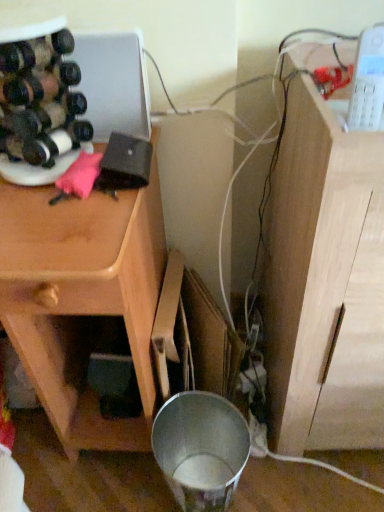
Question: Is matte black wine bottle at left, arranged as the first wine bottle when viewed from the top, thinner than light wood cabinet at right?

Choices:
 (A) yes
 (B) no

Answer: (A)

Question: Is matte black wine bottle at left, arranged as the first wine bottle when viewed from the top, next to light wood cabinet at right and touching it?

Choices:
 (A) yes
 (B) no

Answer: (B)

Question: From a real-world perspective, is matte black wine bottle at left, the 2th wine bottle in the bottom-to-top sequence, located higher than light wood cabinet at right?

Choices:
 (A) yes
 (B) no

Answer: (A)

Question: Considering the relative sizes of matte black wine bottle at left, the 2th wine bottle in the bottom-to-top sequence, and light wood cabinet at right in the image provided, is matte black wine bottle at left, the 2th wine bottle in the bottom-to-top sequence, shorter than light wood cabinet at right?

Choices:
 (A) yes
 (B) no

Answer: (A)

Question: Is the position of matte black wine bottle at left, the 2th wine bottle in the bottom-to-top sequence, less distant than that of light wood cabinet at right?

Choices:
 (A) no
 (B) yes

Answer: (A)

Question: Looking at their shapes, would you say matte black wine bottle at left, the 2th wine bottle in the bottom-to-top sequence, is wider or thinner than matte black wine bottle at left, positioned as the 1th wine bottle in bottom-to-top order?

Choices:
 (A) wide
 (B) thin

Answer: (A)

Question: From the image's perspective, is matte black wine bottle at left, arranged as the first wine bottle when viewed from the top, located above or below matte black wine bottle at left, positioned as the 1th wine bottle in bottom-to-top order?

Choices:
 (A) above
 (B) below

Answer: (A)

Question: From their relative heights in the image, would you say matte black wine bottle at left, arranged as the first wine bottle when viewed from the top, is taller or shorter than matte black wine bottle at left, positioned as the 1th wine bottle in bottom-to-top order?

Choices:
 (A) short
 (B) tall

Answer: (B)

Question: Based on their sizes in the image, would you say matte black wine bottle at left, the 2th wine bottle in the bottom-to-top sequence, is bigger or smaller than matte black wine bottle at left, positioned as the 1th wine bottle in bottom-to-top order?

Choices:
 (A) small
 (B) big

Answer: (B)

Question: Which is correct: light wood cabinet at right is inside wooden cabinet at left, or outside of it?

Choices:
 (A) inside
 (B) outside

Answer: (B)

Question: Is light wood cabinet at right taller or shorter than wooden cabinet at left?

Choices:
 (A) short
 (B) tall

Answer: (B)

Question: Would you say light wood cabinet at right is to the left or to the right of wooden cabinet at left in the picture?

Choices:
 (A) left
 (B) right

Answer: (B)

Question: Considering their positions, is light wood cabinet at right located in front of or behind wooden cabinet at left?

Choices:
 (A) front
 (B) behind

Answer: (A)

Question: In terms of height, does wooden cabinet at left look taller or shorter compared to light wood cabinet at right?

Choices:
 (A) tall
 (B) short

Answer: (B)

Question: Is wooden cabinet at left situated inside light wood cabinet at right or outside?

Choices:
 (A) outside
 (B) inside

Answer: (A)